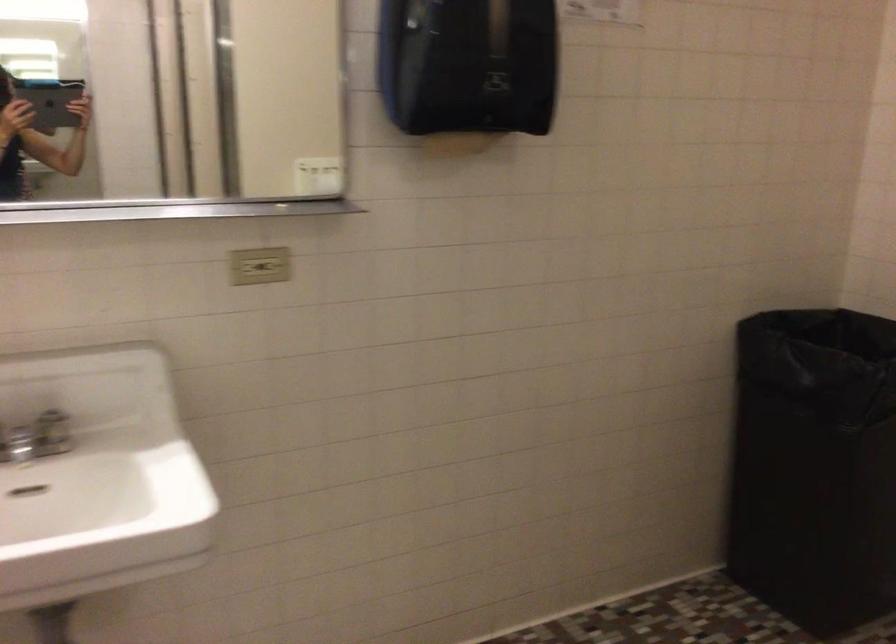
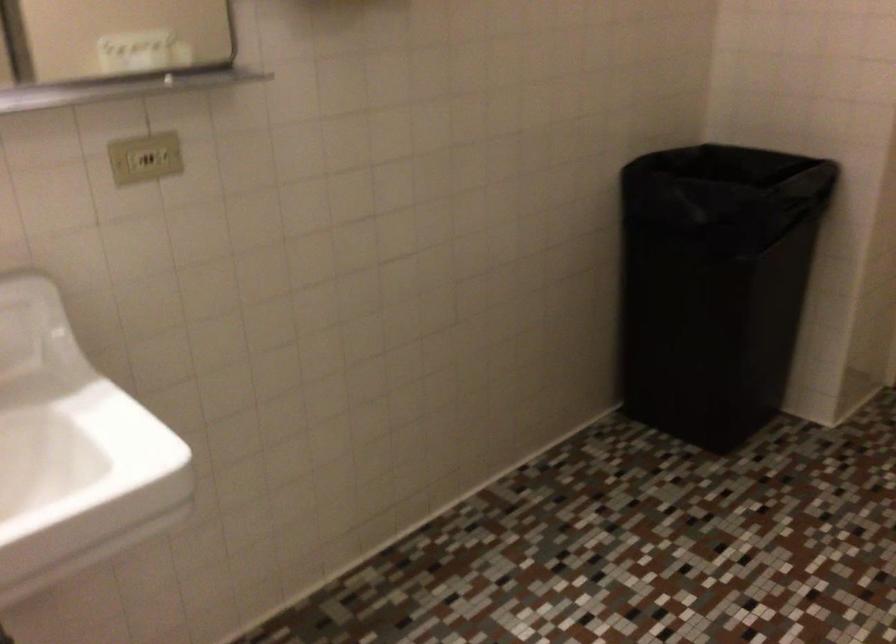
Question: The first image is from the beginning of the video and the second image is from the end. How did the camera likely rotate when shooting the video?

Choices:
 (A) Left
 (B) Right
 (C) Up
 (D) Down

Answer: (B)